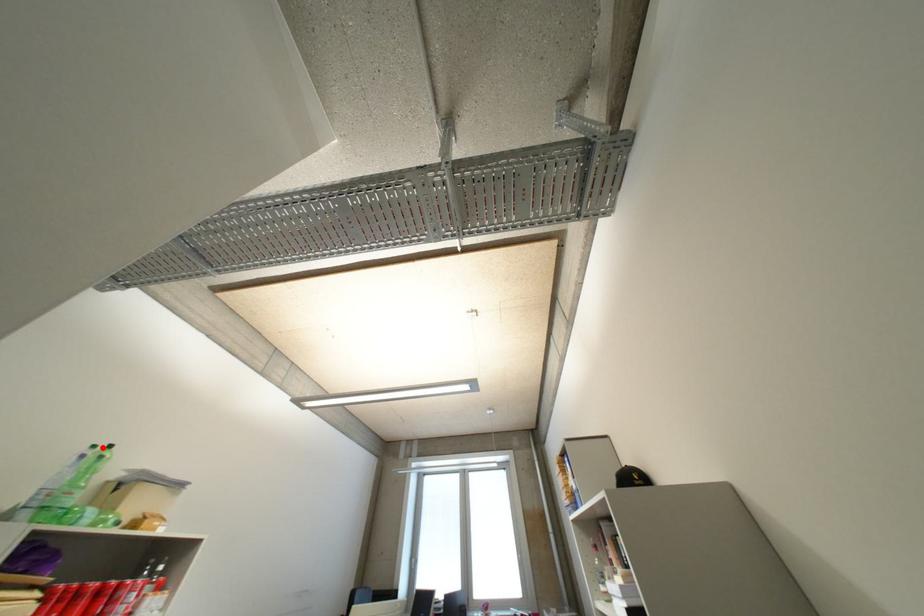
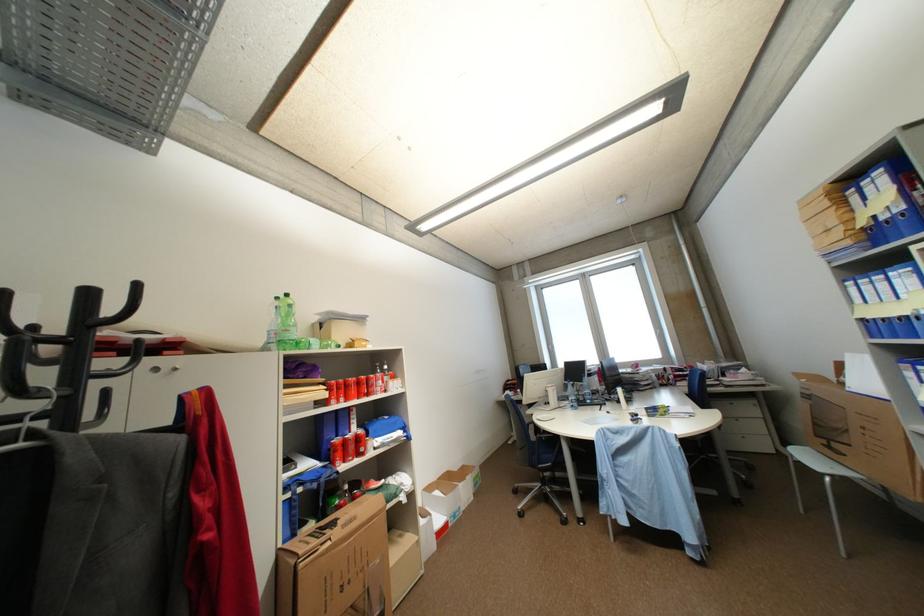
Question: A red point is marked in image1. In image2, is the corresponding 3D point closer to the camera or farther? Reply with the corresponding letter.

Choices:
 (A) The corresponding 3D point is closer.
 (B) The corresponding 3D point is farther.

Answer: (B)